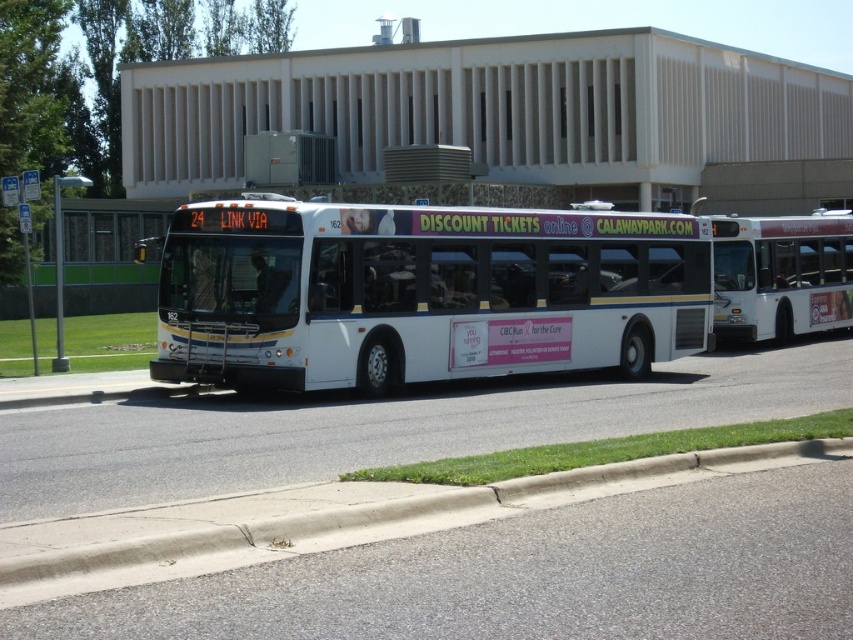
Question: Is gray concrete curb at lower center bigger than white matte bus at right?

Choices:
 (A) no
 (B) yes

Answer: (A)

Question: Which is farther from the white matte bus at right?

Choices:
 (A) gray concrete curb at lower center
 (B) white matte bus at center

Answer: (A)

Question: Estimate the real-world distances between objects in this image. Which object is closer to the gray concrete curb at lower center?

Choices:
 (A) white matte bus at center
 (B) white matte bus at right

Answer: (A)

Question: Can you confirm if gray concrete curb at lower center is positioned to the right of white matte bus at right?

Choices:
 (A) yes
 (B) no

Answer: (B)

Question: Estimate the real-world distances between objects in this image. Which object is closer to the white matte bus at center?

Choices:
 (A) gray concrete curb at lower center
 (B) white matte bus at right

Answer: (B)

Question: Does white matte bus at center have a smaller size compared to white matte bus at right?

Choices:
 (A) no
 (B) yes

Answer: (A)